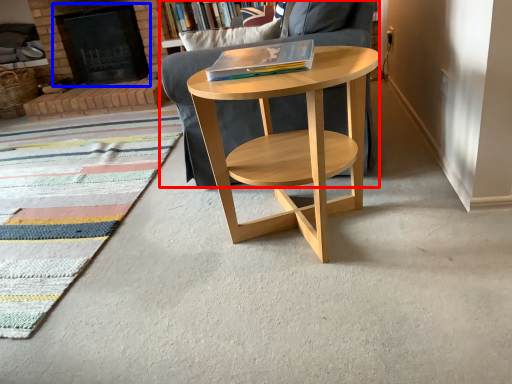
Question: Which object appears closest to the camera in this image, chair (highlighted by a red box) or fireplace (highlighted by a blue box)?

Choices:
 (A) chair
 (B) fireplace

Answer: (A)